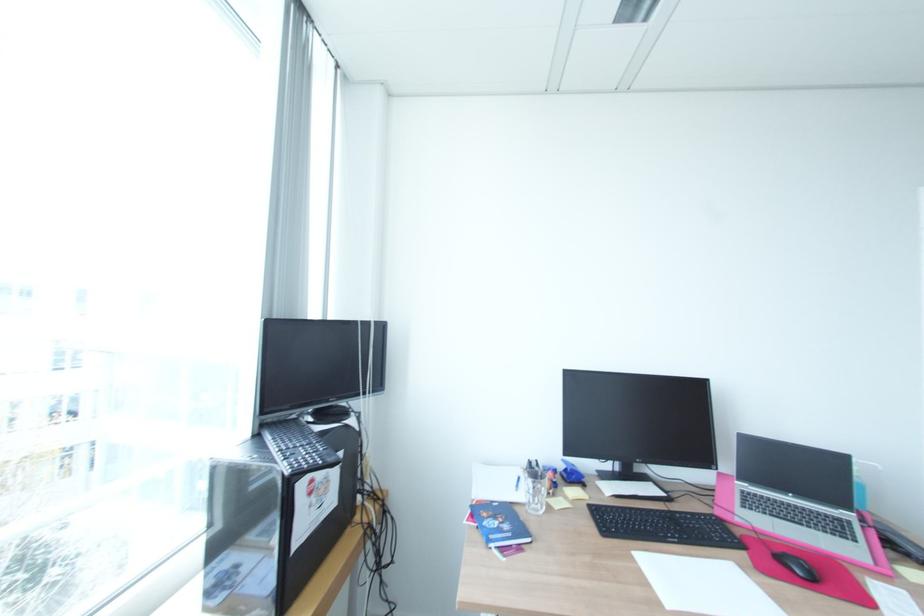
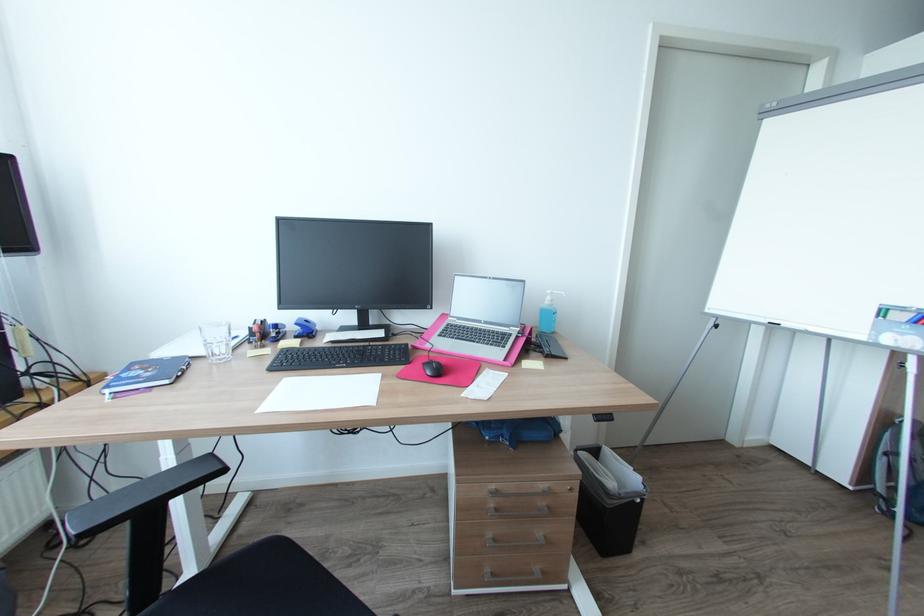
Where in the second image is the point corresponding to point (541, 505) from the first image?

(225, 354)